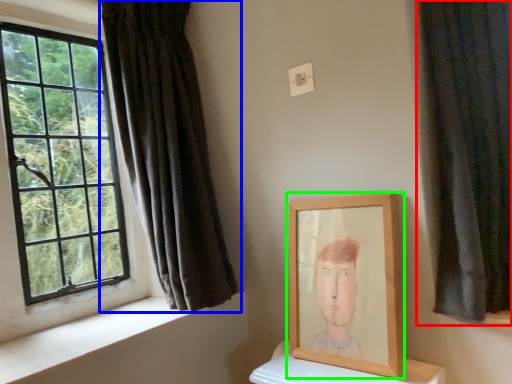
Question: Based on their relative distances, which object is nearer to curtain (highlighted by a red box)? Choose from curtain (highlighted by a blue box) and picture frame (highlighted by a green box).

Choices:
 (A) curtain
 (B) picture frame

Answer: (B)